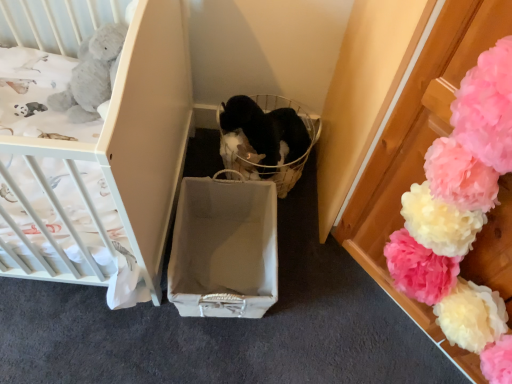
The image size is (512, 384). What do you see at coordinates (224, 249) in the screenshot?
I see `matte gray cardboard box at center` at bounding box center [224, 249].

Measure the distance between point (168,295) and camera.

Point (168,295) is 1.24 meters away from camera.

Describe the element at coordinates (266, 139) in the screenshot. Image resolution: width=512 pixels, height=384 pixels. I see `black fabric basket at center` at that location.

Where is `black fabric basket at center`? This screenshot has width=512, height=384. black fabric basket at center is located at coordinates (266, 139).

This screenshot has height=384, width=512. Find the location of `matte white crib at left`. matte white crib at left is located at coordinates (139, 134).

Does matte white crib at left have a greater width compared to fluffy tissue paper pom-poms at right?

Yes.

Is matte white crib at left facing away from fluffy tissue paper pom-poms at right?

No, matte white crib at left's orientation is not away from fluffy tissue paper pom-poms at right.

Between matte white crib at left and fluffy tissue paper pom-poms at right, which one is positioned in front?

fluffy tissue paper pom-poms at right is closer to the camera.

From the image's perspective, which is below, matte white crib at left or fluffy tissue paper pom-poms at right?

fluffy tissue paper pom-poms at right, from the image's perspective.

Could you tell me if matte gray cardboard box at center is turned towards matte white crib at left?

No.

Do you think matte gray cardboard box at center is within matte white crib at left, or outside of it?

The correct answer is: outside.

Is point (177, 266) behind point (14, 145)?

Yes, it is behind point (14, 145).

From a real-world perspective, is matte gray cardboard box at center physically located above or below matte white crib at left?

Clearly, from a real-world perspective, matte gray cardboard box at center is below matte white crib at left.

In the image, is matte gray cardboard box at center positioned in front of or behind black fabric basket at center?

matte gray cardboard box at center is positioned closer to the viewer than black fabric basket at center.

Is matte gray cardboard box at center bigger or smaller than black fabric basket at center?

In the image, matte gray cardboard box at center appears to be larger than black fabric basket at center.

This screenshot has height=384, width=512. I want to click on flower above the black fabric basket at center (from a real-world perspective), so click(x=461, y=215).

Looking at this image, considering the relative positions of fluffy tissue paper pom-poms at right and black fabric basket at center in the image provided, is fluffy tissue paper pom-poms at right to the right of black fabric basket at center from the viewer's perspective?

Yes, fluffy tissue paper pom-poms at right is to the right of black fabric basket at center.

From a real-world perspective, is fluffy tissue paper pom-poms at right located higher than black fabric basket at center?

Indeed, from a real-world perspective, fluffy tissue paper pom-poms at right stands above black fabric basket at center.

From a real-world perspective, is black fabric basket at center physically located above or below fluffy tissue paper pom-poms at right?

From a real-world perspective, black fabric basket at center is physically below fluffy tissue paper pom-poms at right.

In the scene shown: Looking at their sizes, would you say black fabric basket at center is wider or thinner than fluffy tissue paper pom-poms at right?

Clearly, black fabric basket at center has more width compared to fluffy tissue paper pom-poms at right.

Is point (258, 145) positioned after point (444, 291)?

Yes, point (258, 145) is behind point (444, 291).

Looking at this image, is black fabric basket at center taller than fluffy tissue paper pom-poms at right?

No, black fabric basket at center is not taller than fluffy tissue paper pom-poms at right.

Is fluffy tissue paper pom-poms at right directly adjacent to matte white crib at left?

No.

Is fluffy tissue paper pom-poms at right to the right of matte white crib at left from the viewer's perspective?

Correct, you'll find fluffy tissue paper pom-poms at right to the right of matte white crib at left.

From a real-world perspective, between fluffy tissue paper pom-poms at right and matte white crib at left, who is vertically lower?

matte white crib at left is physically lower.

How far apart are matte gray cardboard box at center and fluffy tissue paper pom-poms at right?

They are 22.72 inches apart.

Identify the location of cardboard box on the left of the fluffy tissue paper pom-poms at right. The height and width of the screenshot is (384, 512). coord(224,249).

In the scene shown: Who is taller, matte gray cardboard box at center or fluffy tissue paper pom-poms at right?

fluffy tissue paper pom-poms at right is taller.

Which point is more forward, (200, 219) or (481, 205)?

Positioned in front is point (481, 205).

The image size is (512, 384). I want to click on infant bed on the left of fluffy tissue paper pom-poms at right, so click(x=139, y=134).

You are a GUI agent. You are given a task and a screenshot of the screen. Output one action in this format:
    pyautogui.click(x=<x>, y=<y>)
    Task: Click on the infant bed in front of the matte gray cardboard box at center
    Image resolution: width=512 pixels, height=384 pixels.
    Given the screenshot: What is the action you would take?
    pyautogui.click(x=139, y=134)

When comparing their distances from black fabric basket at center, does fluffy tissue paper pom-poms at right or matte gray cardboard box at center seem further?

fluffy tissue paper pom-poms at right is positioned further to the anchor black fabric basket at center.

Considering their positions, is matte white crib at left positioned further to black fabric basket at center than matte gray cardboard box at center?

matte white crib at left is positioned further to the anchor black fabric basket at center.

Estimate the real-world distances between objects in this image. Which object is further from fluffy tissue paper pom-poms at right, matte gray cardboard box at center or black fabric basket at center?

black fabric basket at center lies further to fluffy tissue paper pom-poms at right than the other object.

From the image, which object appears to be nearer to matte gray cardboard box at center, fluffy tissue paper pom-poms at right or matte white crib at left?

Based on the image, matte white crib at left appears to be nearer to matte gray cardboard box at center.

Which object lies further to the anchor point black fabric basket at center, matte white crib at left or fluffy tissue paper pom-poms at right?

fluffy tissue paper pom-poms at right.

Considering their positions, is matte gray cardboard box at center positioned closer to matte white crib at left than fluffy tissue paper pom-poms at right?

matte gray cardboard box at center lies closer to matte white crib at left than the other object.

Based on their spatial positions, is matte gray cardboard box at center or fluffy tissue paper pom-poms at right closer to black fabric basket at center?

matte gray cardboard box at center is closer to black fabric basket at center.

Based on their spatial positions, is fluffy tissue paper pom-poms at right or matte white crib at left closer to black fabric basket at center?

matte white crib at left is closer to black fabric basket at center.

Locate an element on the screen. The image size is (512, 384). cardboard box between matte white crib at left and black fabric basket at center from left to right is located at coordinates (224, 249).

Image resolution: width=512 pixels, height=384 pixels. Find the location of `baby carriage between matte white crib at left and fluffy tissue paper pom-poms at right in the horizontal direction`. baby carriage between matte white crib at left and fluffy tissue paper pom-poms at right in the horizontal direction is located at coordinates (266, 139).

Identify the location of cardboard box between matte white crib at left and fluffy tissue paper pom-poms at right. The image size is (512, 384). (224, 249).

In order to click on cardboard box between fluffy tissue paper pom-poms at right and black fabric basket at center from front to back in this screenshot , I will do `click(224, 249)`.